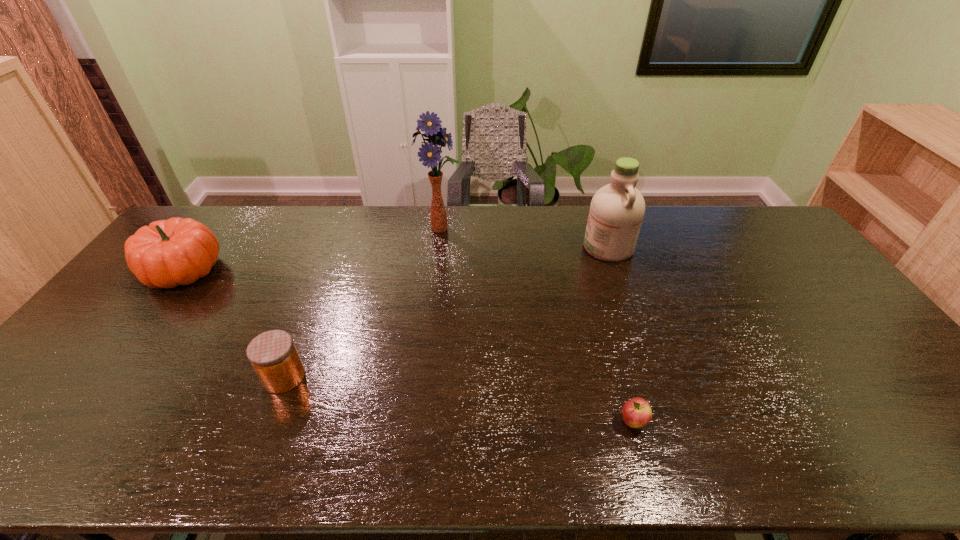
The width and height of the screenshot is (960, 540). Identify the location of free space at the far edge of the desktop. (335, 244).

Image resolution: width=960 pixels, height=540 pixels. Find the location of `free space at the near edge of the desktop`. free space at the near edge of the desktop is located at coordinates (112, 460).

In the image, there is a desktop. Find the location of `vacant space at the left edge`. vacant space at the left edge is located at coordinates point(20,420).

This screenshot has width=960, height=540. Find the location of `free space at the right edge`. free space at the right edge is located at coordinates (857, 378).

Where is `free space at the near left corner of the desktop`? free space at the near left corner of the desktop is located at coordinates (52, 431).

The image size is (960, 540). I want to click on free spot between the second tallest object and the second shortest object, so click(x=446, y=312).

Where is `blank region between the jar and the nearest object`? blank region between the jar and the nearest object is located at coordinates (459, 400).

The height and width of the screenshot is (540, 960). I want to click on vacant space that is in between the leftmost object and the cleansing agent, so click(x=396, y=259).

The height and width of the screenshot is (540, 960). Identify the location of free space between the tallest object and the third tallest object. pyautogui.click(x=312, y=249).

This screenshot has height=540, width=960. Find the location of `vacant area that lies between the tallest object and the second object from left to right`. vacant area that lies between the tallest object and the second object from left to right is located at coordinates (363, 303).